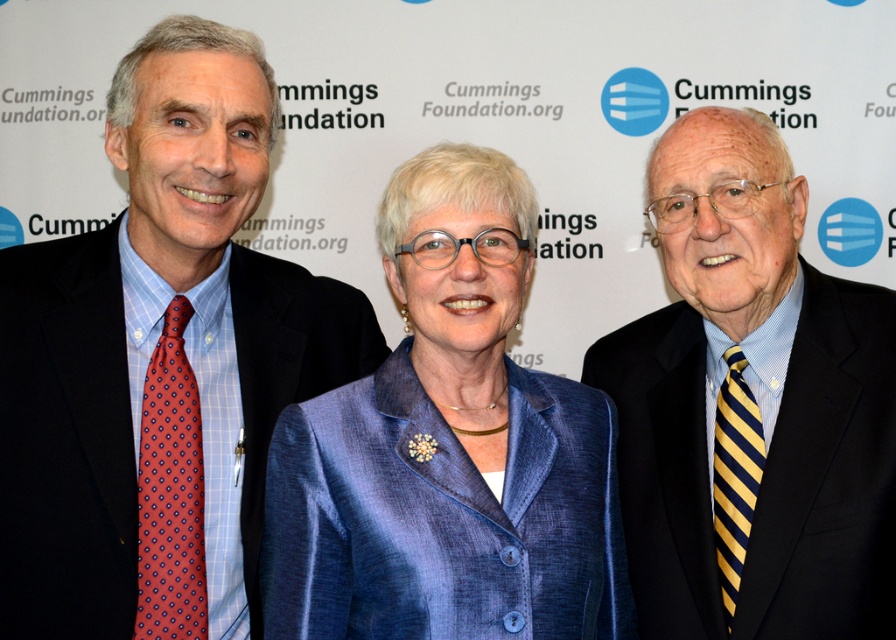
Question: Does blue satin blazer at center appear over blue striped tie at right?

Choices:
 (A) yes
 (B) no

Answer: (B)

Question: Which point is farther to the camera?

Choices:
 (A) (470, 346)
 (B) (798, 353)
 (C) (75, 376)

Answer: (B)

Question: Is matte black suit at left to the left of blue satin blazer at center from the viewer's perspective?

Choices:
 (A) yes
 (B) no

Answer: (A)

Question: Considering the real-world distances, which object is closest to the blue satin blazer at center?

Choices:
 (A) blue striped tie at right
 (B) matte black suit at left

Answer: (A)

Question: Does matte black suit at left appear on the right side of blue satin blazer at center?

Choices:
 (A) yes
 (B) no

Answer: (B)

Question: Which point is closer to the camera taking this photo?

Choices:
 (A) (802, 268)
 (B) (266, 492)

Answer: (B)